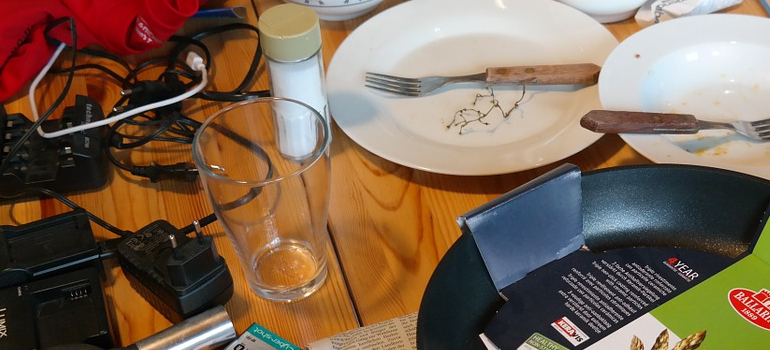
Locate an element on the screen. The width and height of the screenshot is (770, 350). white cord is located at coordinates (179, 93).